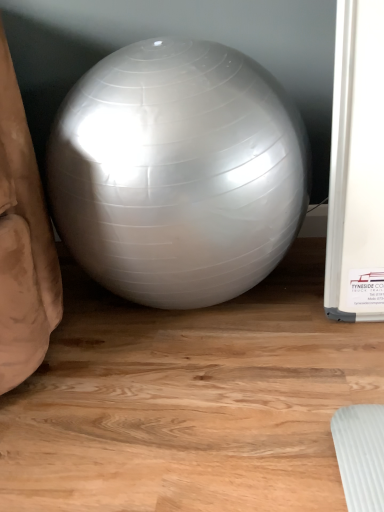
What is the approximate width of silver glossy ball at center?

It is 20.44 inches.

The height and width of the screenshot is (512, 384). In order to click on silver glossy ball at center in this screenshot , I will do coord(178,173).

What do you see at coordinates (178, 173) in the screenshot? I see `silver glossy ball at center` at bounding box center [178, 173].

Find the location of `silver glossy ball at center`. silver glossy ball at center is located at coordinates (178, 173).